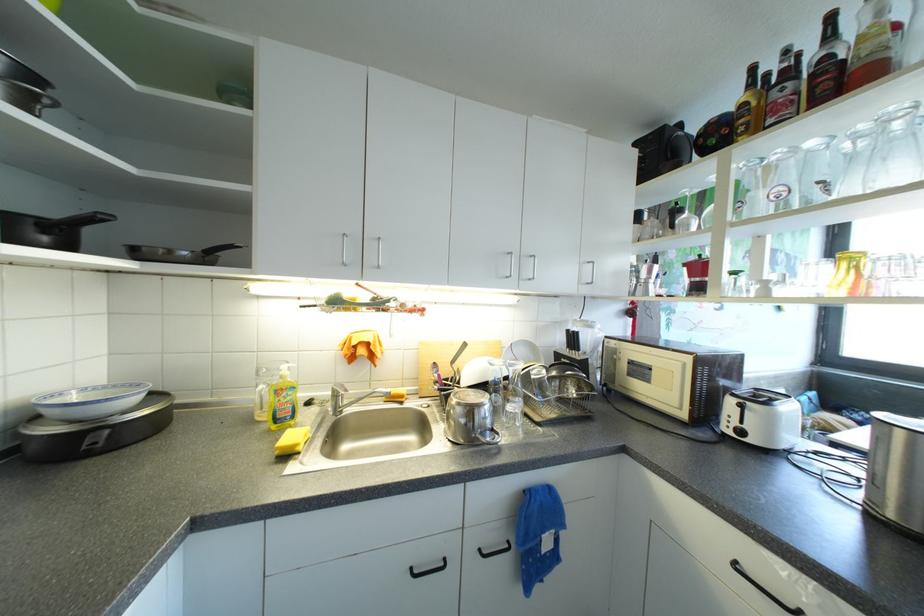
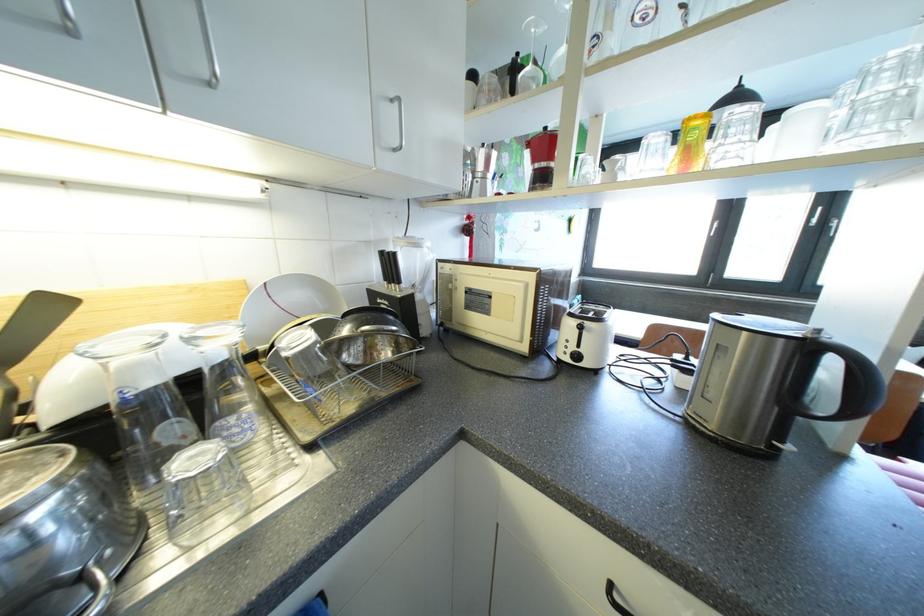
Locate, in the second image, the point that corresponds to (x=596, y=285) in the first image.

(403, 146)